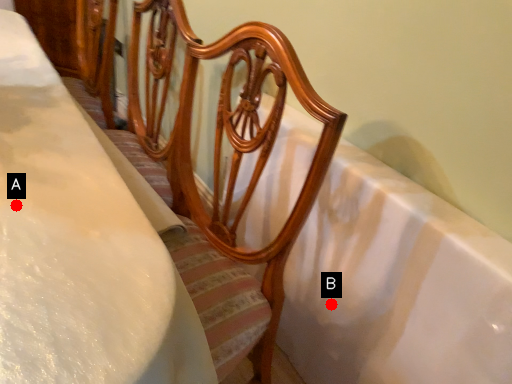
Question: Two points are circled on the image, labeled by A and B beside each circle. Which point is farther to the camera?

Choices:
 (A) A is further
 (B) B is further

Answer: (B)